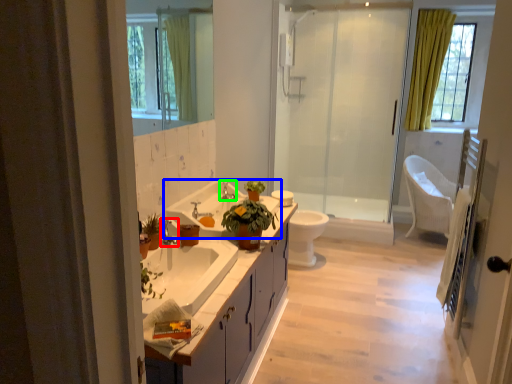
Question: Based on their relative distances, which object is farther from faucet (highlighted by a red box)? Choose from sink (highlighted by a blue box) and tap (highlighted by a green box).

Choices:
 (A) sink
 (B) tap

Answer: (B)